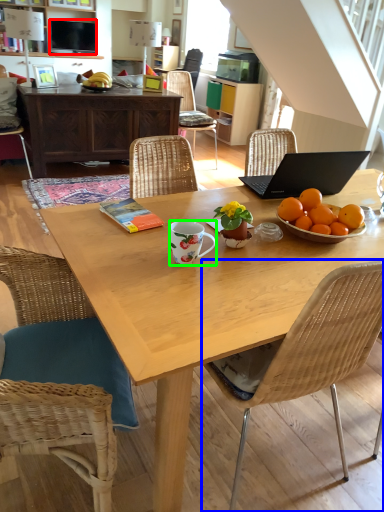
Question: Which object is the farthest from television (highlighted by a red box)? Choose among these: chair (highlighted by a blue box) or coffee cup (highlighted by a green box).

Choices:
 (A) chair
 (B) coffee cup

Answer: (A)